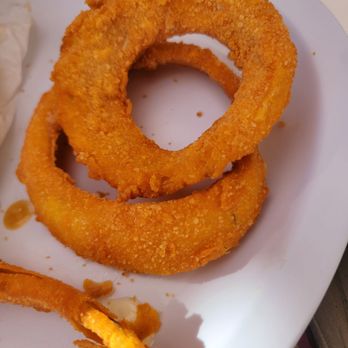
This screenshot has width=348, height=348. I want to click on white plate, so click(274, 287).